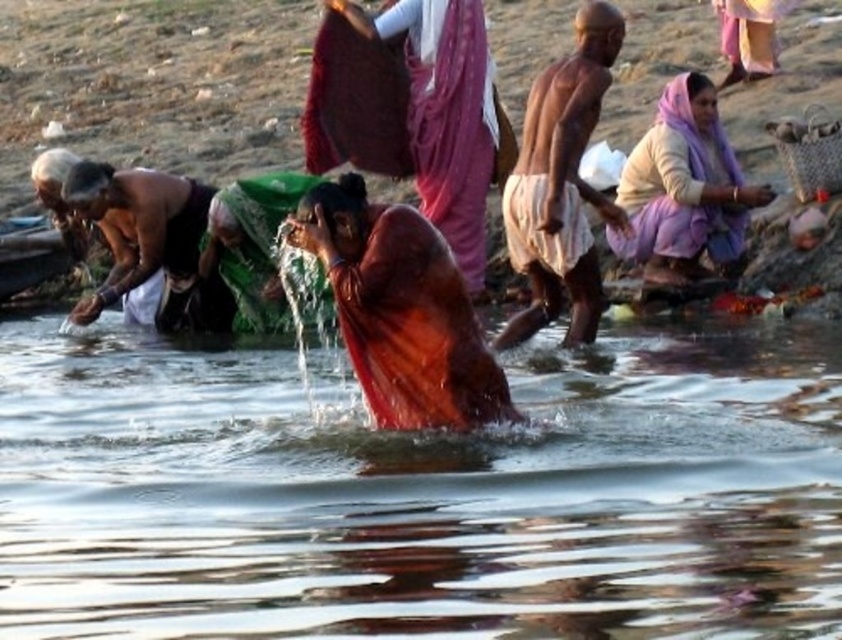
In the scene shown: You are a photographer trying to capture the scene of the ritualistic bathing. You want to ensure that both the transparent water at center and the purple fabric headscarf at upper right are clearly visible in your photo. Based on their positions, which object should you focus on first to ensure both are in focus?

The purple fabric headscarf at upper right is positioned above the transparent water at center. To ensure both are in focus, you should focus on the purple fabric headscarf at upper right first, as it is farther away, allowing the transparent water at center to remain within the depth of field.

Based on the scene described, which object is shorter between the transparent water at center and the matte orange robe at center?

The transparent water at center is shorter than the matte orange robe at center.